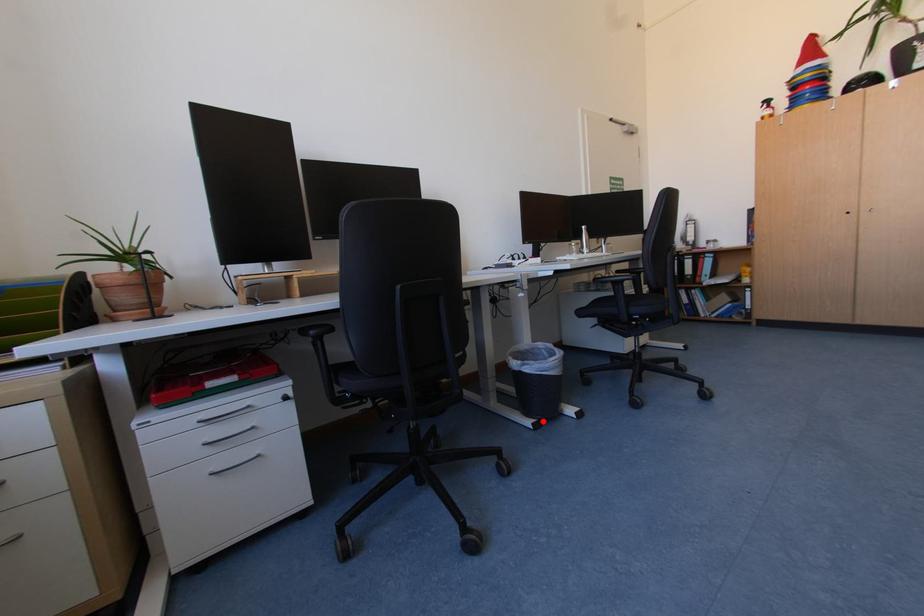
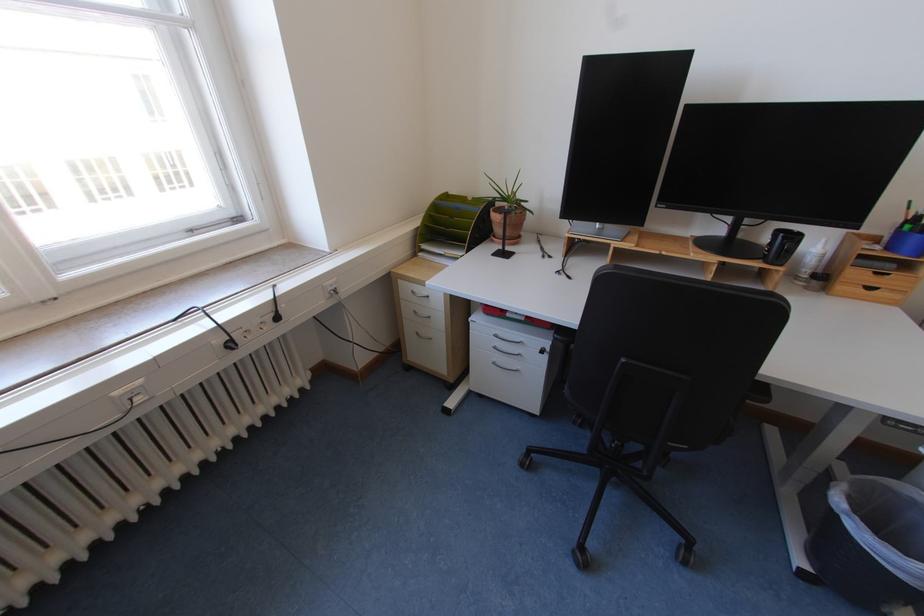
Question: I am providing you with two images of the same scene from different viewpoints. A red point is marked on the first image. At the location where the point appears in image 1, is it still visible in image 2?

Choices:
 (A) Yes
 (B) No

Answer: (A)